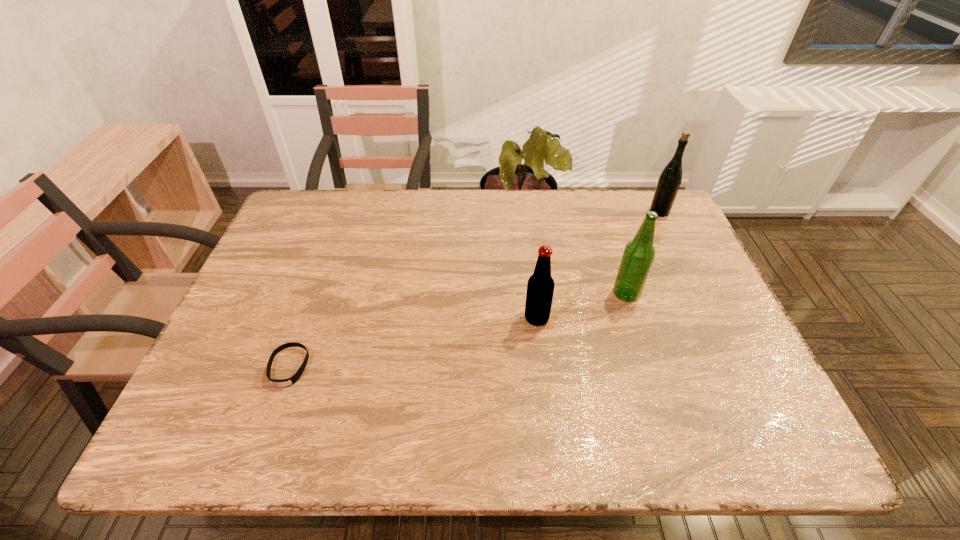
Locate an element on the screen. the rightmost beer bottle is located at coordinates (670, 178).

Identify the location of the farthest object. The width and height of the screenshot is (960, 540). (670, 178).

I want to click on the third nearest object, so click(x=638, y=256).

Locate an element on the screen. This screenshot has height=540, width=960. the second nearest beer bottle is located at coordinates (638, 256).

Locate an element on the screen. The width and height of the screenshot is (960, 540). the leftmost beer bottle is located at coordinates (540, 287).

Where is `the nearest beer bottle`? The width and height of the screenshot is (960, 540). the nearest beer bottle is located at coordinates (540, 287).

Find the location of `the nearest object`. the nearest object is located at coordinates (290, 381).

The height and width of the screenshot is (540, 960). I want to click on the shortest object, so click(x=290, y=381).

Locate an element on the screen. The width and height of the screenshot is (960, 540). vacant space located 0.150m on the left of the rightmost beer bottle is located at coordinates (600, 211).

Locate an element on the screen. free location located on the label of the third object from left to right is located at coordinates (568, 294).